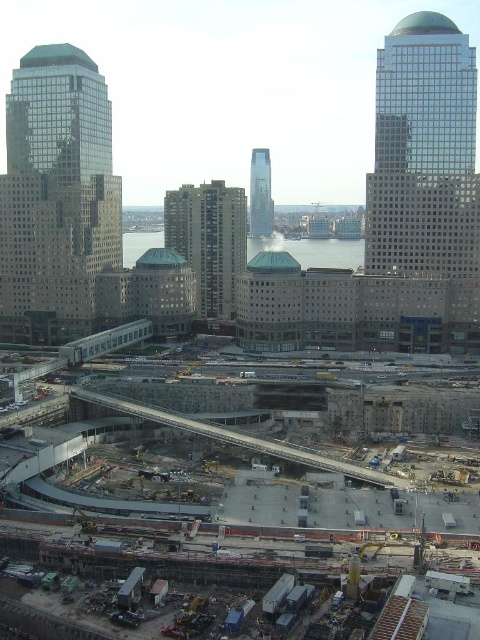
Where is `concrete at center`? The width and height of the screenshot is (480, 640). concrete at center is located at coordinates (84, 451).

Can you confirm if concrete at center is thinner than gray concrete train track at center?

Incorrect, concrete at center's width is not less than gray concrete train track at center's.

The height and width of the screenshot is (640, 480). I want to click on concrete at center, so point(84,451).